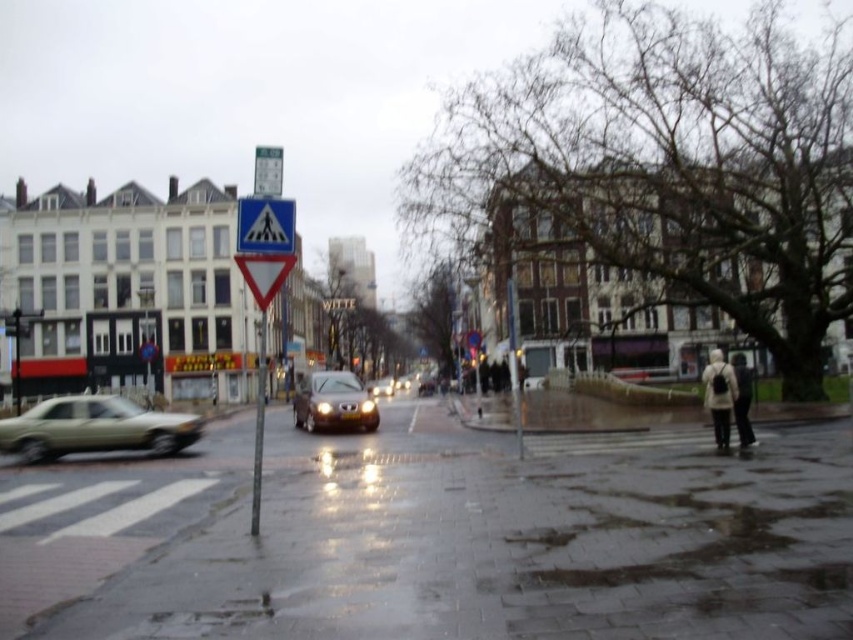
Does metallic gold sedan at left come behind shiny brown car at center?

No, it is not.

Which of these two, metallic gold sedan at left or shiny brown car at center, stands shorter?

metallic gold sedan at left

This screenshot has width=853, height=640. In order to click on metallic gold sedan at left in this screenshot , I will do `click(94, 428)`.

Where is `metallic gold sedan at left`? Image resolution: width=853 pixels, height=640 pixels. metallic gold sedan at left is located at coordinates (x=94, y=428).

Measure the distance from white plastic pedestrian crossing sign at upper center to dark gray knit sweater at lower right.

They are 18.21 meters apart.

Can you confirm if white plastic pedestrian crossing sign at upper center is taller than dark gray knit sweater at lower right?

No.

Who is more forward, (293, 212) or (708, 388)?

Point (293, 212) is more forward.

Where is `white plastic pedestrian crossing sign at upper center`? white plastic pedestrian crossing sign at upper center is located at coordinates (265, 225).

Looking at this image, is white plastic pedestrian crossing sign at upper center bigger than dark brown leather coat at lower right?

No.

Can you confirm if white plastic pedestrian crossing sign at upper center is positioned above dark brown leather coat at lower right?

Indeed, white plastic pedestrian crossing sign at upper center is positioned over dark brown leather coat at lower right.

Does point (276, 216) come closer to viewer compared to point (746, 433)?

Yes, point (276, 216) is closer to viewer.

Identify the location of white plastic pedestrian crossing sign at upper center. The width and height of the screenshot is (853, 640). (265, 225).